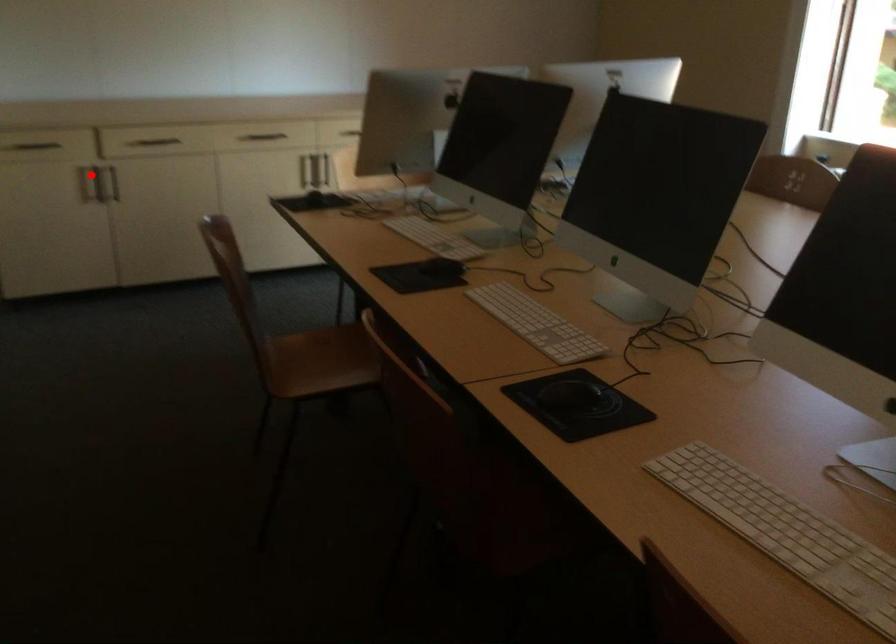
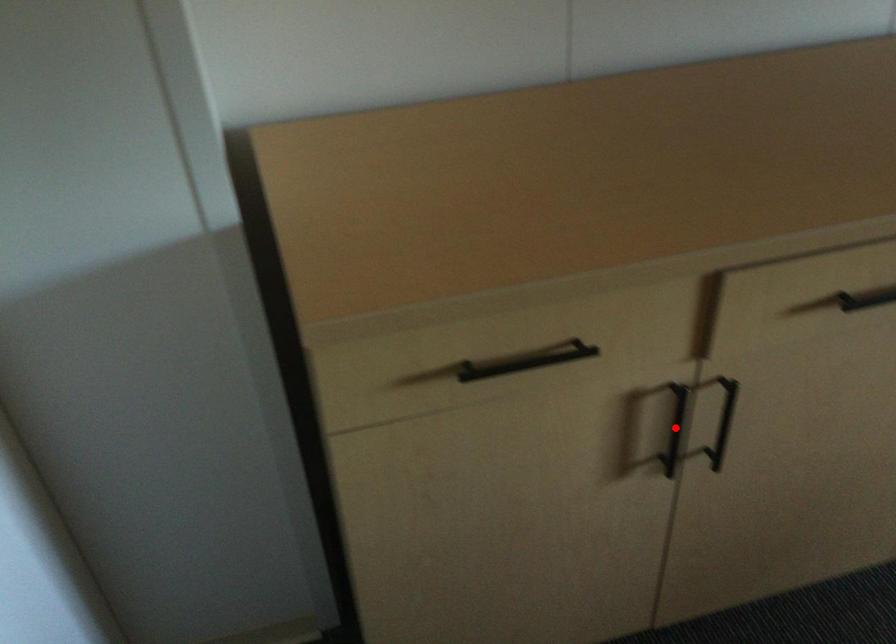
I am providing you with two images of the same scene from different viewpoints. A red point is marked on the first image and another point is marked on the second image. Do the highlighted points in image1 and image2 indicate the same real-world spot?

Yes